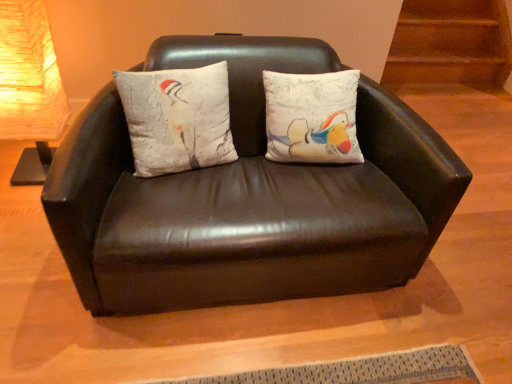
Identify the location of matte black couch at center. Image resolution: width=512 pixels, height=384 pixels. (248, 197).

Image resolution: width=512 pixels, height=384 pixels. I want to click on textured white pillow with bird design at center, so click(177, 118).

The width and height of the screenshot is (512, 384). What are the coordinates of `matte black couch at center` in the screenshot? It's located at (248, 197).

Considering the sizes of matte white lampshade at left and textured white pillow with bird design at center in the image, is matte white lampshade at left bigger or smaller than textured white pillow with bird design at center?

matte white lampshade at left is bigger than textured white pillow with bird design at center.

Is matte white lampshade at left inside or outside of textured white pillow with bird design at center?

The correct answer is: outside.

Between matte white lampshade at left and textured white pillow with bird design at center, which one has larger width?

matte white lampshade at left is wider.

From the image's perspective, is matte white lampshade at left under textured white pillow with bird design at center?

No.

Considering the positions of objects textured white pillow with bird design at center and matte white lampshade at left in the image provided, who is more to the left, textured white pillow with bird design at center or matte white lampshade at left?

From the viewer's perspective, matte white lampshade at left appears more on the left side.

Identify the location of pillow below the matte white lampshade at left (from the image's perspective). Image resolution: width=512 pixels, height=384 pixels. (177, 118).

Based on the photo, which of these two, textured white pillow with bird design at center or matte white lampshade at left, is bigger?

matte white lampshade at left is bigger.

Looking at this image, does textured white pillow with bird design at center have a lesser width compared to matte white lampshade at left?

Yes.

Is textured white pillow with bird design at center to the right of matte black couch at center from the viewer's perspective?

In fact, textured white pillow with bird design at center is to the left of matte black couch at center.

Choose the correct answer: Is textured white pillow with bird design at center inside matte black couch at center or outside it?

The correct answer is: inside.

Considering the relative sizes of textured white pillow with bird design at center and matte black couch at center in the image provided, is textured white pillow with bird design at center bigger than matte black couch at center?

Actually, textured white pillow with bird design at center might be smaller than matte black couch at center.

From the image's perspective, which object appears higher, textured white pillow with bird design at center or matte black couch at center?

textured white pillow with bird design at center is shown above in the image.

Is matte white lampshade at left in front of or behind matte black couch at center in the image?

In the image, matte white lampshade at left appears behind matte black couch at center.

From a real-world perspective, is matte white lampshade at left located higher than matte black couch at center?

Yes, from a real-world perspective, matte white lampshade at left is over matte black couch at center

Is there a large distance between matte white lampshade at left and matte black couch at center?

No, matte white lampshade at left is not far away from matte black couch at center.

Considering the relative sizes of matte white lampshade at left and matte black couch at center in the image provided, is matte white lampshade at left wider than matte black couch at center?

In fact, matte white lampshade at left might be narrower than matte black couch at center.

Is matte black couch at center not near textured white pillow with bird design at center?

matte black couch at center is actually quite close to textured white pillow with bird design at center.

Is textured white pillow with bird design at center inside matte black couch at center?

Yes, textured white pillow with bird design at center is surrounded by matte black couch at center.

From the image's perspective, between matte black couch at center and textured white pillow with bird design at center, which one is located above?

textured white pillow with bird design at center, from the image's perspective.

In the image, there is a matte white lampshade at left. Where is `studio couch below it (from the image's perspective)`? This screenshot has width=512, height=384. studio couch below it (from the image's perspective) is located at coordinates (248, 197).

From the picture: Which object is thinner, matte black couch at center or matte white lampshade at left?

matte white lampshade at left is thinner.

Considering the sizes of objects matte black couch at center and matte white lampshade at left in the image provided, who is bigger, matte black couch at center or matte white lampshade at left?

Bigger between the two is matte black couch at center.

Who is taller, matte black couch at center or matte white lampshade at left?

Standing taller between the two is matte white lampshade at left.

Where is `pillow located on the right of matte white lampshade at left`? pillow located on the right of matte white lampshade at left is located at coordinates (177, 118).

In the image, there is a matte white lampshade at left. Where is `pillow below it (from the image's perspective)`? This screenshot has height=384, width=512. pillow below it (from the image's perspective) is located at coordinates (177, 118).

When comparing their distances from matte white lampshade at left, does textured white pillow with bird design at center or matte black couch at center seem closer?

textured white pillow with bird design at center is closer to matte white lampshade at left.

Based on their spatial positions, is matte white lampshade at left or textured white pillow with bird design at center closer to matte black couch at center?

textured white pillow with bird design at center lies closer to matte black couch at center than the other object.

Estimate the real-world distances between objects in this image. Which object is further from matte white lampshade at left, matte black couch at center or textured white pillow with bird design at center?

matte black couch at center.

Which object lies nearer to the anchor point textured white pillow with bird design at center, matte white lampshade at left or matte black couch at center?

matte black couch at center lies closer to textured white pillow with bird design at center than the other object.

Which object lies further to the anchor point textured white pillow with bird design at center, matte black couch at center or matte white lampshade at left?

matte white lampshade at left is positioned further to the anchor textured white pillow with bird design at center.

Which object lies further to the anchor point matte black couch at center, textured white pillow with bird design at center or matte white lampshade at left?

matte white lampshade at left is further to matte black couch at center.

Locate an element on the screen. pillow situated between matte white lampshade at left and matte black couch at center from left to right is located at coordinates (177, 118).